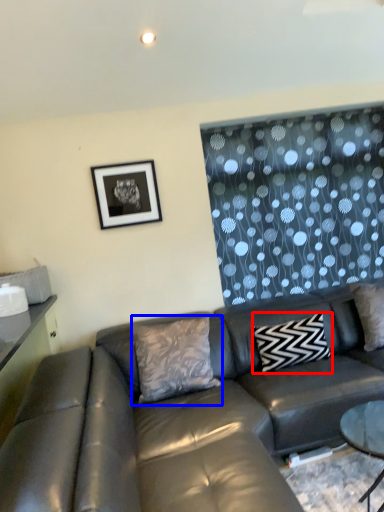
Question: Among these objects, which one is nearest to the camera, pillow (highlighted by a red box) or pillow (highlighted by a blue box)?

Choices:
 (A) pillow
 (B) pillow

Answer: (B)